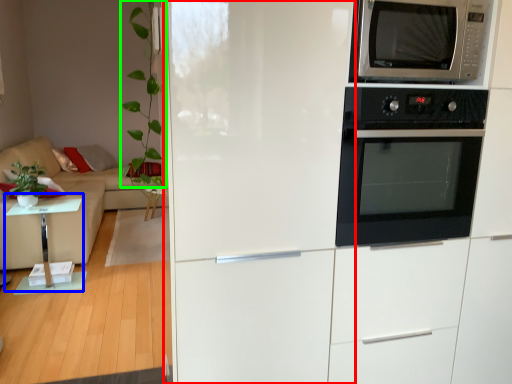
Question: Which object is the closest to the fridge (highlighted by a red box)? Choose among these: table (highlighted by a blue box) or plant (highlighted by a green box).

Choices:
 (A) table
 (B) plant

Answer: (B)